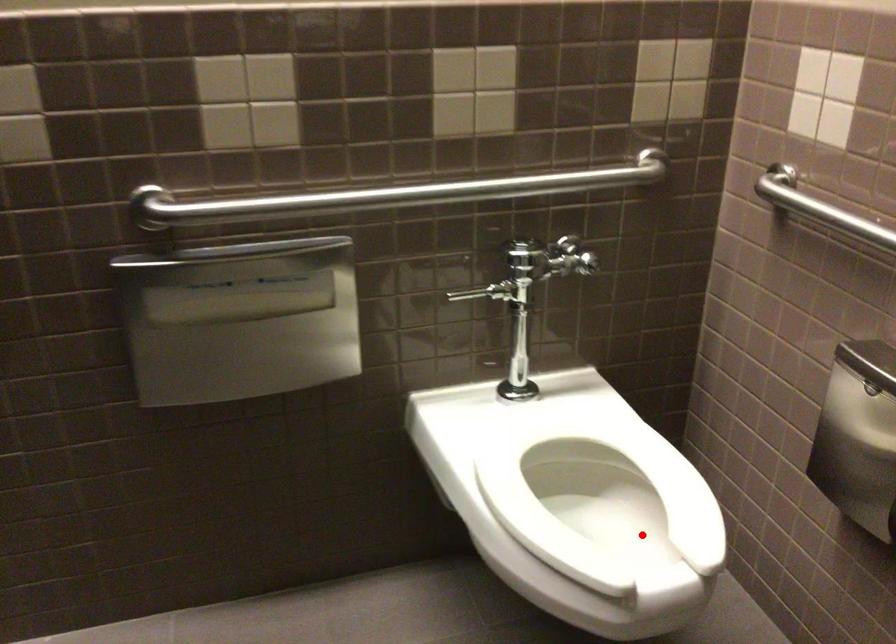
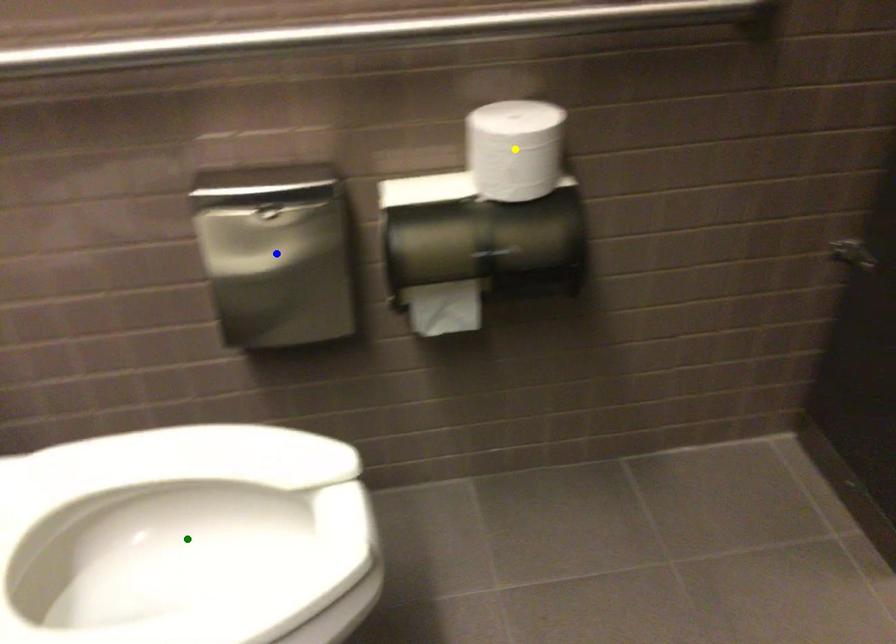
Question: I am providing you with two images of the same scene from different viewpoints. A red point is marked on the first image. You are given multiple points on the second image. Can you choose the point in image 2 that corresponds to the point in image 1?

Choices:
 (A) blue point
 (B) yellow point
 (C) green point

Answer: (C)